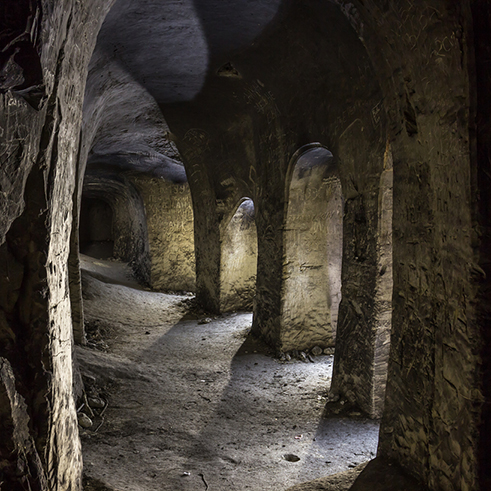
Where is `floor`? The image size is (491, 491). floor is located at coordinates (182, 377).